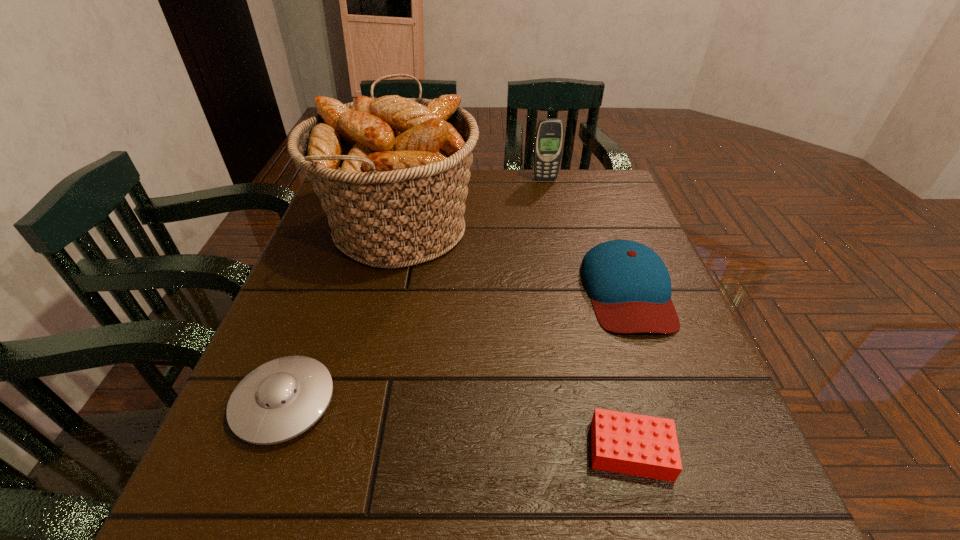
In the image, there is a desktop. At what (x,y) coordinates should I click in order to perform the action: click on vacant space at the far edge. Please return your answer as a coordinate pair (x, y). Looking at the image, I should click on (534, 199).

In the image, there is a desktop. Identify the location of vacant space at the left edge. (298, 298).

The height and width of the screenshot is (540, 960). I want to click on vacant space at the far right corner, so click(x=584, y=182).

Where is `free spot at the near right corner of the desktop`? The width and height of the screenshot is (960, 540). free spot at the near right corner of the desktop is located at coordinates (730, 482).

What are the coordinates of `vacant area that lies between the tallest object and the Lego` in the screenshot? It's located at (515, 339).

Where is `vacant region between the saucer and the basket`? The height and width of the screenshot is (540, 960). vacant region between the saucer and the basket is located at coordinates (342, 315).

The height and width of the screenshot is (540, 960). I want to click on unoccupied position between the shortest object and the baseball cap, so click(x=629, y=370).

This screenshot has height=540, width=960. Identify the location of empty space between the Lego and the cellular telephone. (588, 315).

Locate an element on the screen. free space that is in between the baseball cap and the fourth tallest object is located at coordinates (456, 347).

Find the location of a particular element. empty location between the second tallest object and the Lego is located at coordinates (588, 315).